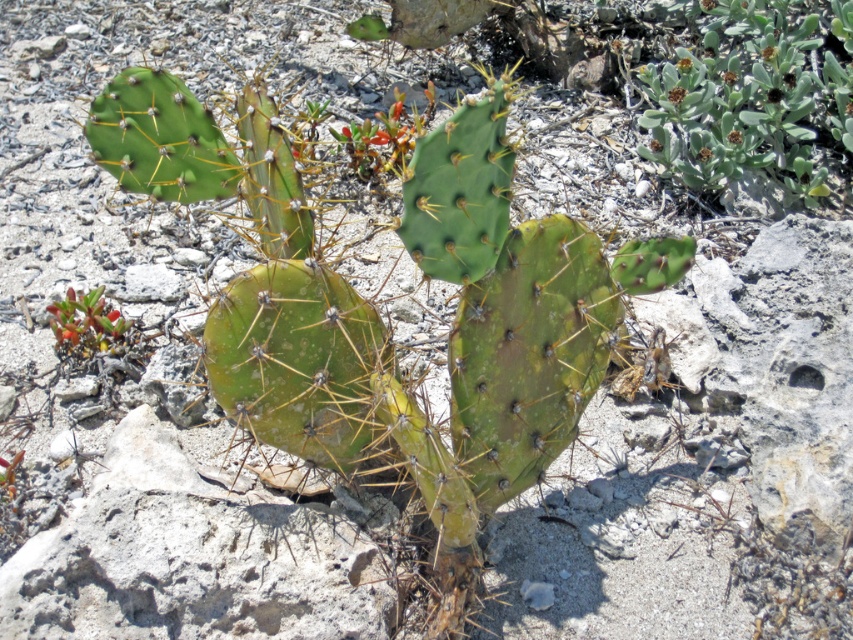
Between point (505, 349) and point (401, 104), which one is positioned in front?

Positioned in front is point (505, 349).

Who is higher up, green spiny cactus at center or smooth orange flower at center?

smooth orange flower at center is above.

Who is more forward, (x=328, y=432) or (x=405, y=156)?

Point (x=328, y=432) is more forward.

Identify the location of green spiny cactus at center. (375, 312).

Can you confirm if smooth orange flower at center is positioned to the right of green succulent at lower left?

Correct, you'll find smooth orange flower at center to the right of green succulent at lower left.

Does point (430, 100) come closer to viewer compared to point (71, 296)?

No, (430, 100) is further to viewer.

Is point (372, 140) positioned before point (86, 305)?

No, it is behind (86, 305).

The image size is (853, 640). What are the coordinates of `smooth orange flower at center` in the screenshot? It's located at (386, 136).

Where is `green spiny cactus at center`? green spiny cactus at center is located at coordinates (375, 312).

Can you confirm if green spiny cactus at center is thinner than green fuzzy plant at upper right?

Incorrect, green spiny cactus at center's width is not less than green fuzzy plant at upper right's.

Between point (502, 472) and point (851, 12), which one is positioned behind?

The point (851, 12) is behind.

The height and width of the screenshot is (640, 853). I want to click on green spiny cactus at center, so click(x=375, y=312).